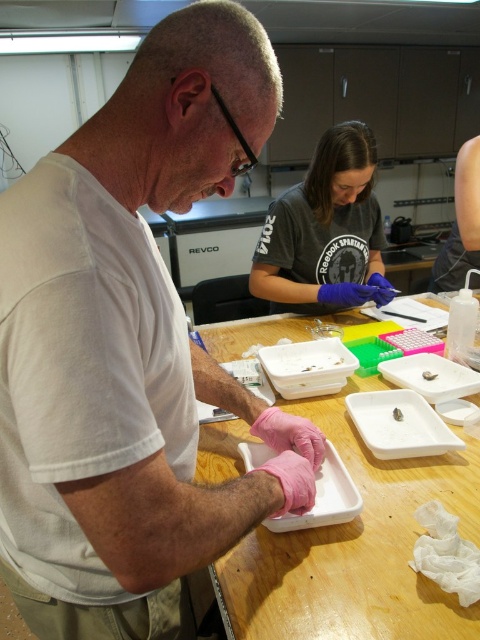
You are a lab assistant who needs to place a new tool on the table. The tool requires a surface that is taller than the pink rubber gloves at left. Can the white plastic tray at center provide this surface?

The pink rubber gloves at left are taller than the white plastic tray at center, so the white plastic tray at center cannot provide a surface taller than the pink rubber gloves at left.